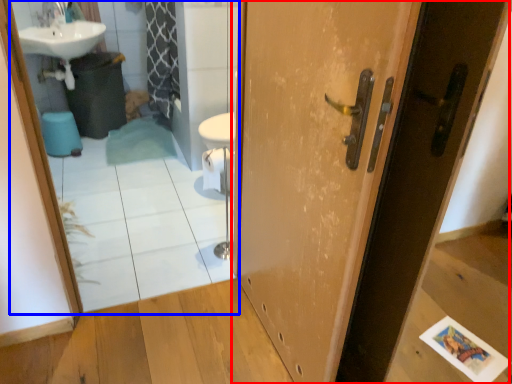
Question: Which object is further to the camera taking this photo, door (highlighted by a red box) or mirror (highlighted by a blue box)?

Choices:
 (A) door
 (B) mirror

Answer: (B)